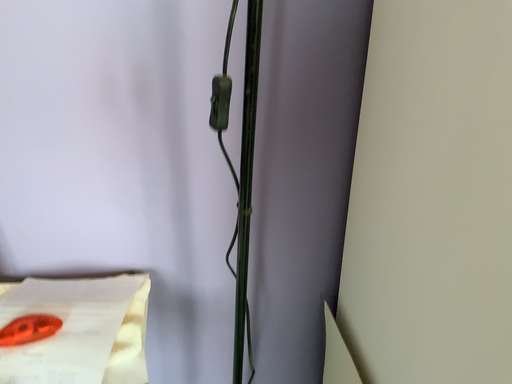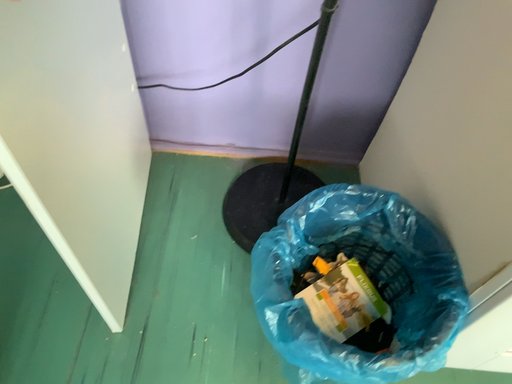
Question: How did the camera likely rotate when shooting the video?

Choices:
 (A) rotated right
 (B) rotated left

Answer: (B)